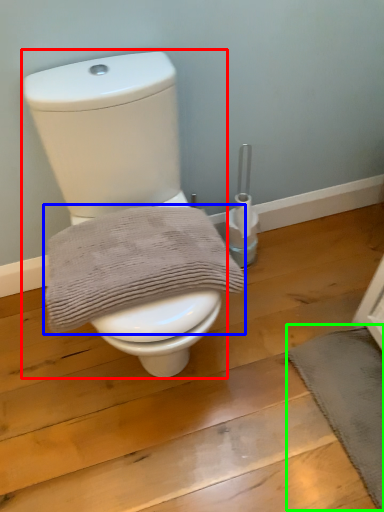
Question: Which is nearer to the toilet (highlighted by a red box)? bath towel (highlighted by a blue box) or bath mat (highlighted by a green box).

Choices:
 (A) bath towel
 (B) bath mat

Answer: (A)